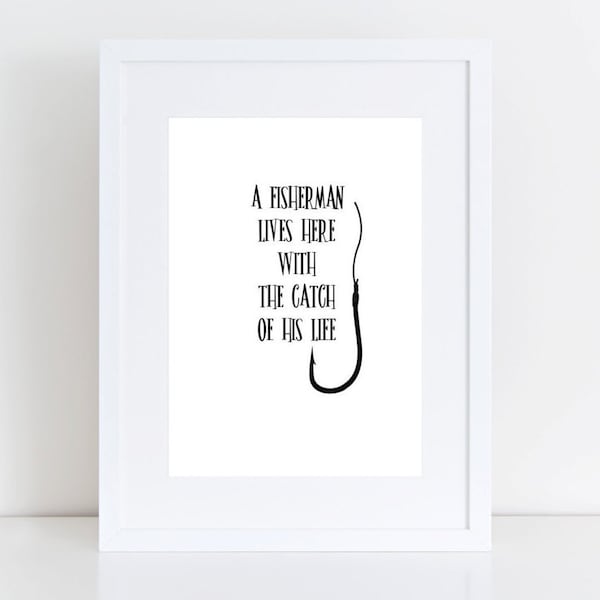
Where is `shelf`? Image resolution: width=600 pixels, height=600 pixels. shelf is located at coordinates (558, 554).